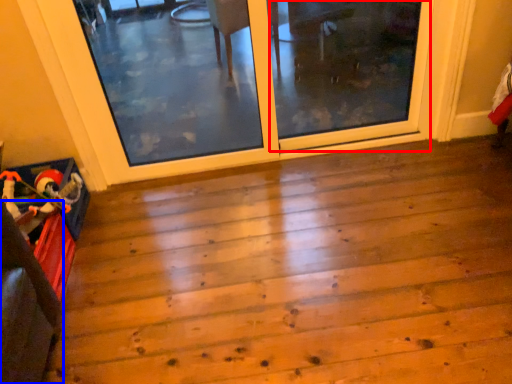
Question: Which point is closer to the camera, screen door (highlighted by a red box) or furniture (highlighted by a blue box)?

Choices:
 (A) screen door
 (B) furniture

Answer: (B)